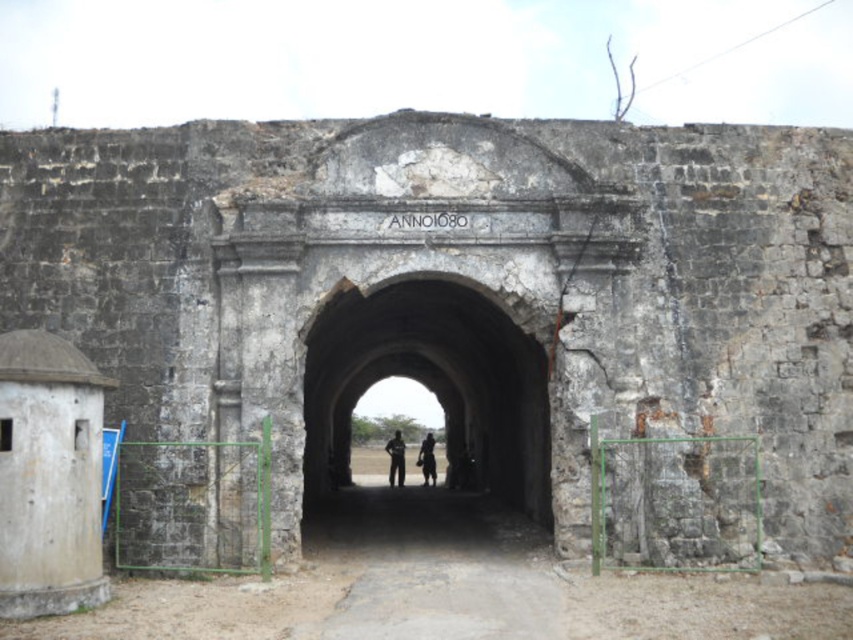
This screenshot has height=640, width=853. What are the coordinates of `rusty stone tunnel at center` in the screenshot? It's located at (432, 387).

Can you confirm if rusty stone tunnel at center is positioned above dark skin textured person at center?

Indeed, rusty stone tunnel at center is positioned over dark skin textured person at center.

In the scene shown: Is rusty stone tunnel at center to the left of dark skin textured person at center from the viewer's perspective?

Correct, you'll find rusty stone tunnel at center to the left of dark skin textured person at center.

Does point (372, 353) come behind point (428, 448)?

No, it is not.

You are a GUI agent. You are given a task and a screenshot of the screen. Output one action in this format:
    pyautogui.click(x=<x>, y=<y>)
    Task: Click on the rusty stone tunnel at center
    
    Given the screenshot: What is the action you would take?
    pyautogui.click(x=432, y=387)

How much distance is there between black matte person at center and dark skin textured person at center?

black matte person at center and dark skin textured person at center are 4.07 meters apart.

Where is `black matte person at center`? The height and width of the screenshot is (640, 853). black matte person at center is located at coordinates (395, 460).

What do you see at coordinates (395, 460) in the screenshot? I see `black matte person at center` at bounding box center [395, 460].

Find the location of a particular element. The width and height of the screenshot is (853, 640). black matte person at center is located at coordinates (395, 460).